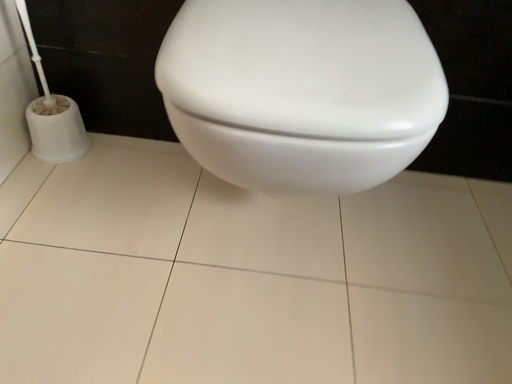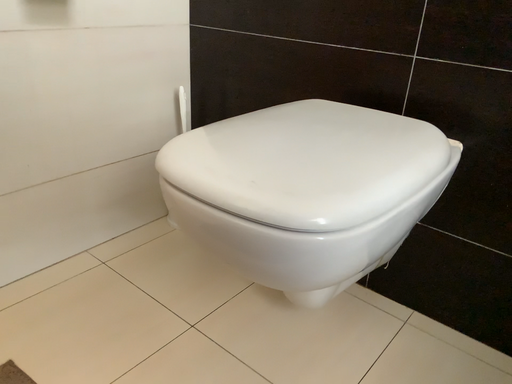
Question: How did the camera likely rotate when shooting the video?

Choices:
 (A) rotated downward
 (B) rotated upward

Answer: (B)